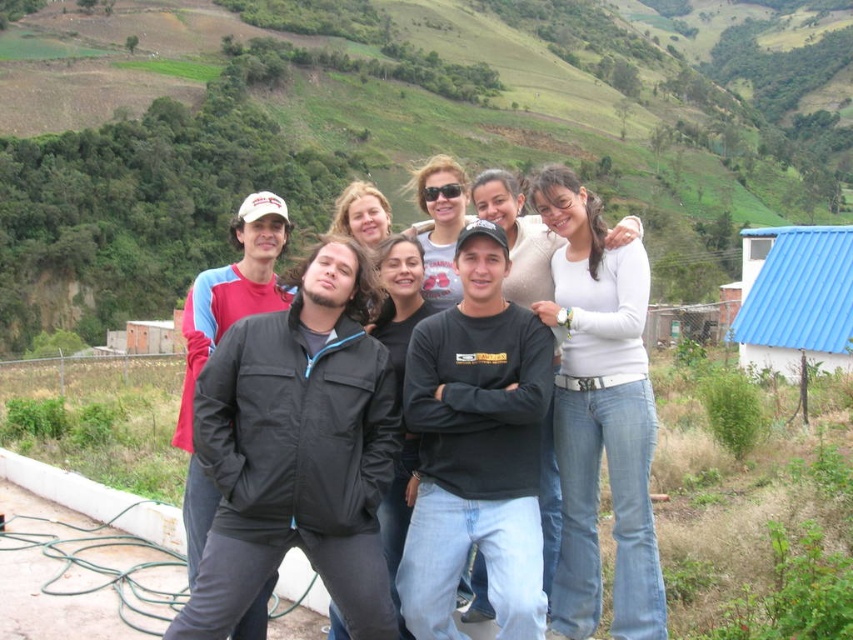
The width and height of the screenshot is (853, 640). What do you see at coordinates (397, 125) in the screenshot? I see `green grassy hillside at upper center` at bounding box center [397, 125].

Can you confirm if green grassy hillside at upper center is thinner than black matte jacket at center?

Incorrect, green grassy hillside at upper center's width is not less than black matte jacket at center's.

Between point (26, 26) and point (270, 560), which one is positioned in front?

Positioned in front is point (270, 560).

In order to click on green grassy hillside at upper center in this screenshot , I will do `click(397, 125)`.

Which is in front, point (521, 22) or point (648, 520)?

Point (648, 520) is in front.

Is green grassy hillside at upper center further to camera compared to white matte shirt at center?

That is True.

Who is more distant from viewer, (457, 131) or (573, 634)?

Positioned behind is point (457, 131).

The width and height of the screenshot is (853, 640). Find the location of `green grassy hillside at upper center`. green grassy hillside at upper center is located at coordinates (397, 125).

Measure the distance between black matte jacket at center and white matte shirt at center.

12.18 feet

Is point (245, 472) positioned after point (604, 385)?

No.

Does point (358, 404) come closer to viewer compared to point (624, 586)?

No.

Image resolution: width=853 pixels, height=640 pixels. Find the location of `black matte jacket at center`. black matte jacket at center is located at coordinates (299, 451).